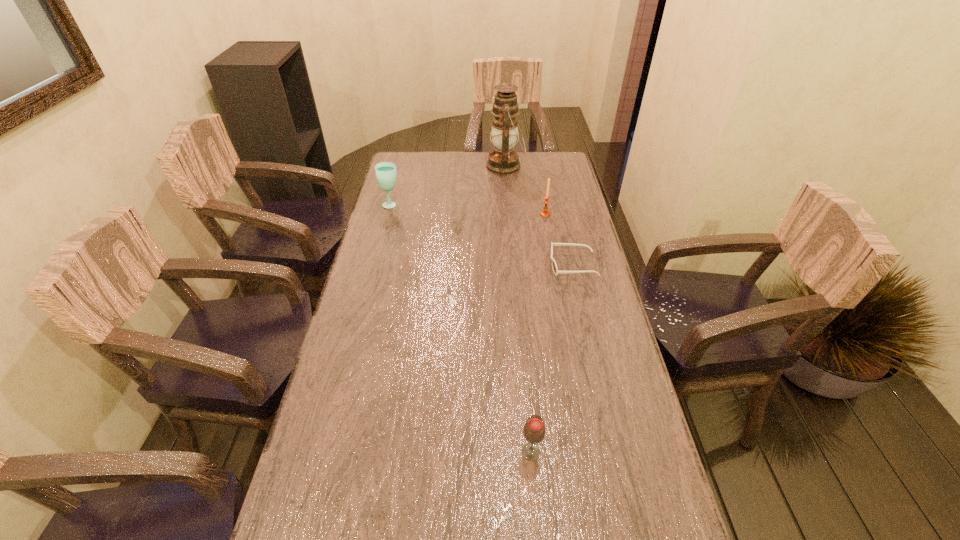
What are the coordinates of `vacant space in between the third farthest object and the nearest object` in the screenshot? It's located at (538, 333).

Locate an element on the screen. The width and height of the screenshot is (960, 540). free space between the leftmost object and the third nearest object is located at coordinates (468, 209).

You are a GUI agent. You are given a task and a screenshot of the screen. Output one action in this format:
    pyautogui.click(x=<x>, y=<y>)
    Task: Click on the object that stands as the closest to the third farthest object
    
    Given the screenshot: What is the action you would take?
    pyautogui.click(x=554, y=266)

Locate which object ranks fourth in proximity to the farthest object. Please provide its 2D coordinates. Your answer should be formatted as a tuple, i.e. [(x, y)], where the tuple contains the x and y coordinates of a point satisfying the conditions above.

[(534, 429)]

Where is `vacant region that satisfies the following two spatial constraints: 1. on the front side of the leftmost object; 2. on the left side of the shorter glass drink container`? The image size is (960, 540). vacant region that satisfies the following two spatial constraints: 1. on the front side of the leftmost object; 2. on the left side of the shorter glass drink container is located at coordinates (326, 451).